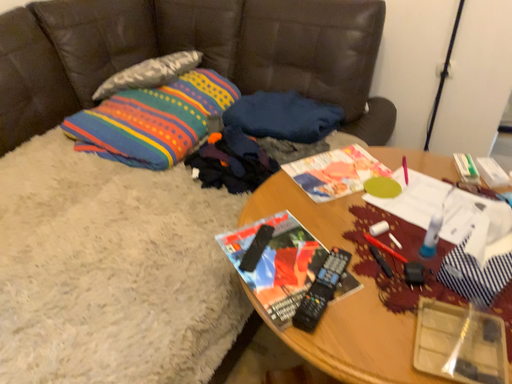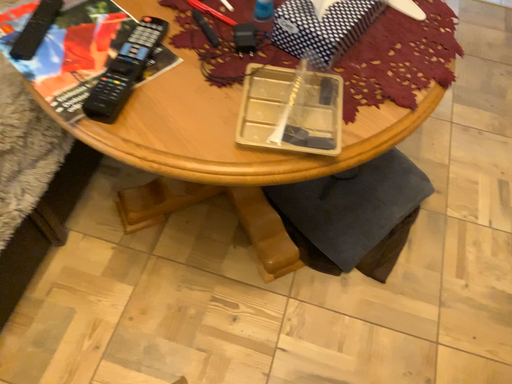
Question: Which way did the camera rotate in the video?

Choices:
 (A) rotated right
 (B) rotated left

Answer: (A)